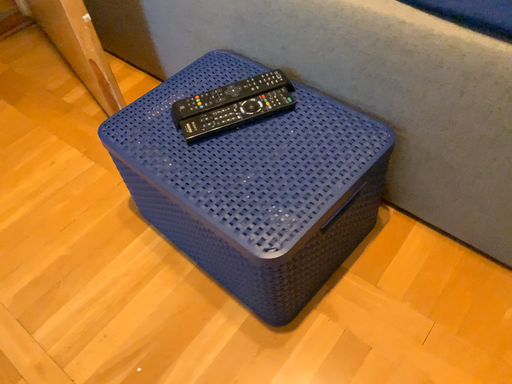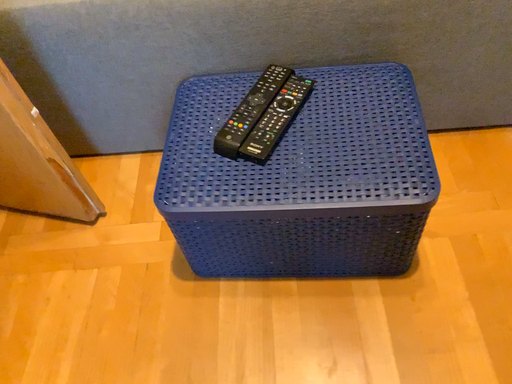
Question: Which way did the camera rotate in the video?

Choices:
 (A) rotated left
 (B) rotated right

Answer: (B)